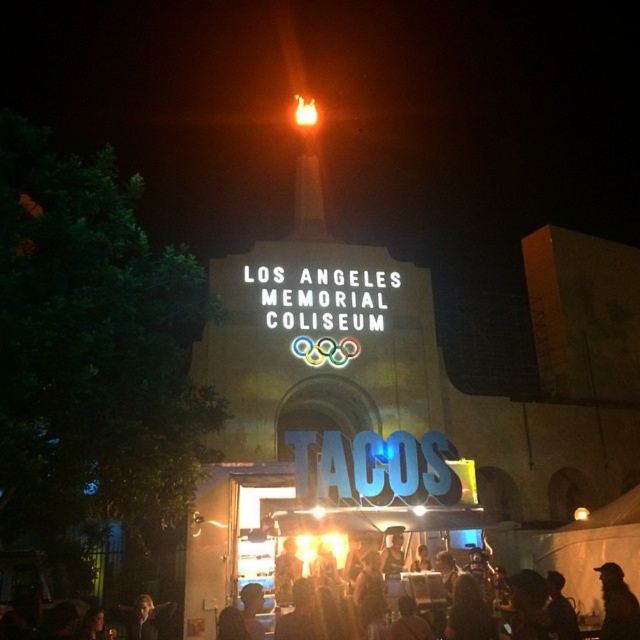
Does black matte crowd at lower center have a greater height compared to silhouette fabric at lower right?

Correct, black matte crowd at lower center is much taller as silhouette fabric at lower right.

Locate an element on the screen. This screenshot has width=640, height=640. black matte crowd at lower center is located at coordinates (572, 556).